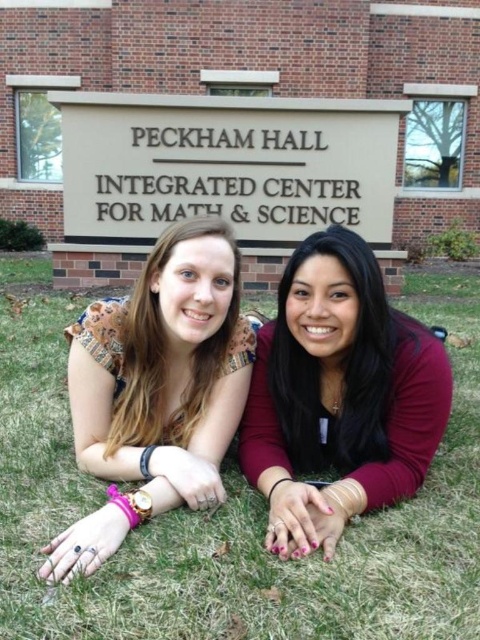
Is point (475, 384) less distant than point (389, 420)?

No, it is not.

Is green grass at lower center below maroon fabric shirt at center?

Correct, green grass at lower center is located below maroon fabric shirt at center.

Between point (321, 564) and point (274, 490), which one is positioned in front?

Point (321, 564) is in front.

Where is `green grass at lower center`? The width and height of the screenshot is (480, 640). green grass at lower center is located at coordinates coord(228,513).

Is maroon fabric shirt at center thinner than matte brown hair at center?

Incorrect, maroon fabric shirt at center's width is not less than matte brown hair at center's.

Can you confirm if maroon fabric shirt at center is positioned below matte brown hair at center?

Correct, maroon fabric shirt at center is located below matte brown hair at center.

Find the location of a particular element. The width and height of the screenshot is (480, 640). maroon fabric shirt at center is located at coordinates (338, 396).

How far apart are maroon fabric shirt at center and matte black shirt at center?

They are 3.96 inches apart.

Does maroon fabric shirt at center have a lesser height compared to matte black shirt at center?

No.

Between point (283, 472) and point (365, 444), which one is positioned behind?

The point (365, 444) is more distant.

Locate an element on the screen. The width and height of the screenshot is (480, 640). maroon fabric shirt at center is located at coordinates (338, 396).